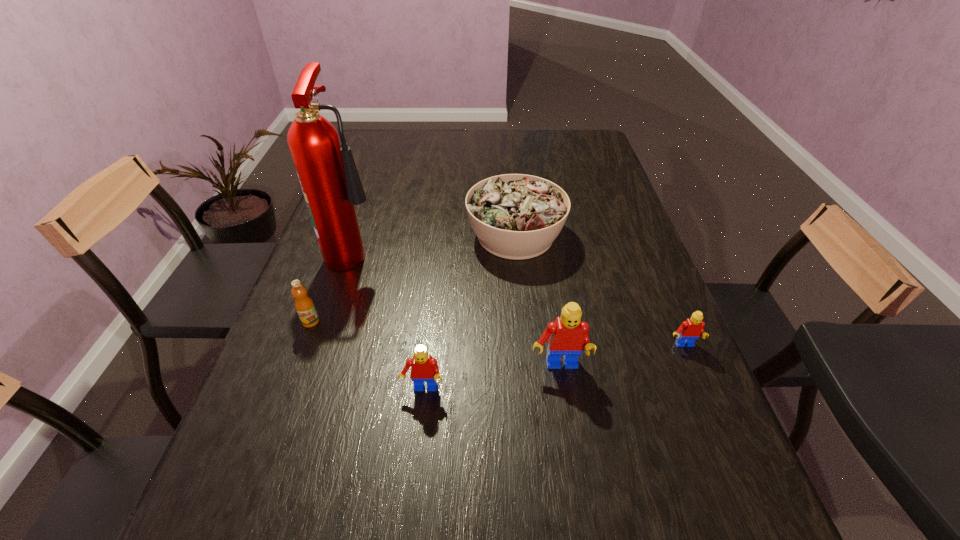
The width and height of the screenshot is (960, 540). What are the coordinates of `vacant area between the fourth nearest object and the farthest Lego` in the screenshot? It's located at (497, 334).

Identify the location of free spot between the second Lego from right to left and the fire extinguisher. (457, 309).

This screenshot has width=960, height=540. In order to click on vacant area between the salad and the fire extinguisher in this screenshot , I will do `click(435, 243)`.

At what (x,y) coordinates should I click in order to perform the action: click on object that is the fifth closest to the orange juice. Please return your answer as a coordinate pair (x, y). The height and width of the screenshot is (540, 960). Looking at the image, I should click on (691, 329).

Locate which object ranks in proximity to the second Lego from right to left. Please provide its 2D coordinates. Your answer should be formatted as a tuple, i.e. [(x, y)], where the tuple contains the x and y coordinates of a point satisfying the conditions above.

[(424, 368)]

Select which Lego appears as the second closest to the shortest object. Please provide its 2D coordinates. Your answer should be formatted as a tuple, i.e. [(x, y)], where the tuple contains the x and y coordinates of a point satisfying the conditions above.

[(424, 368)]

Select which Lego is the closest to the second Lego from left to right. Please provide its 2D coordinates. Your answer should be formatted as a tuple, i.e. [(x, y)], where the tuple contains the x and y coordinates of a point satisfying the conditions above.

[(424, 368)]